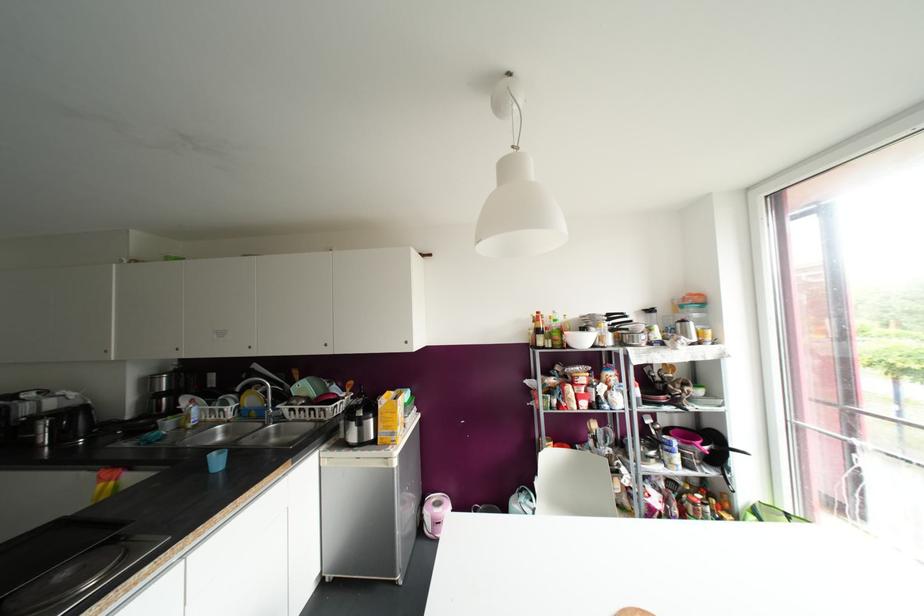
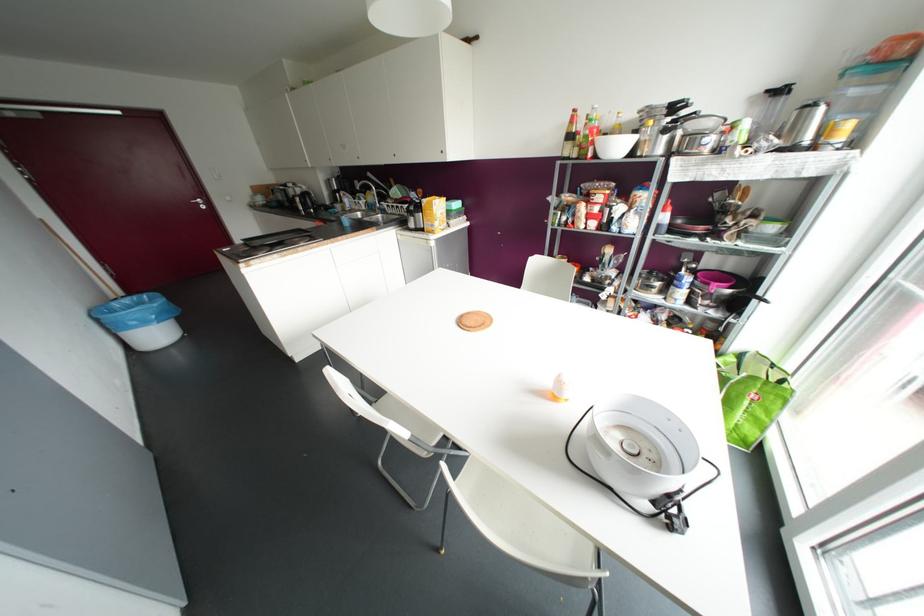
Find the pixel in the second image that matches (x=687, y=446) in the first image.

(703, 286)